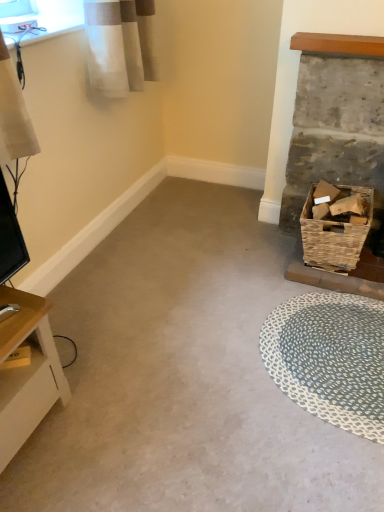
Question: Considering the positions of woven brown basket at right and light wood table at lower left in the image, is woven brown basket at right taller or shorter than light wood table at lower left?

Choices:
 (A) tall
 (B) short

Answer: (B)

Question: From the image's perspective, is woven brown basket at right located above or below light wood table at lower left?

Choices:
 (A) above
 (B) below

Answer: (A)

Question: Which of these objects is positioned closest to the woven brown basket at right?

Choices:
 (A) rustic wicker basket at right
 (B) blue woven mat at lower right
 (C) light wood table at lower left

Answer: (A)

Question: Which is nearer to the woven brown basket at right?

Choices:
 (A) rustic wicker basket at right
 (B) light wood table at lower left
 (C) blue woven mat at lower right

Answer: (A)